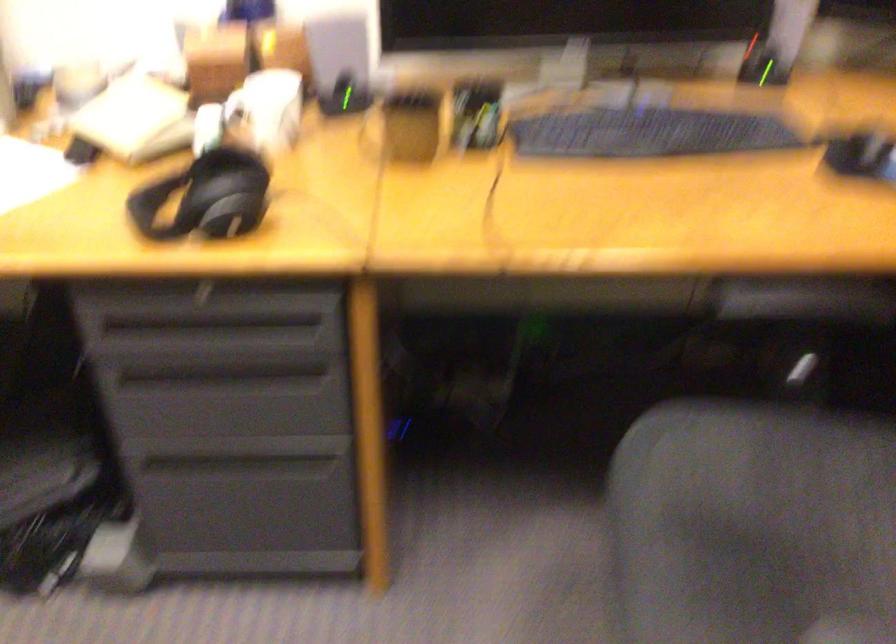
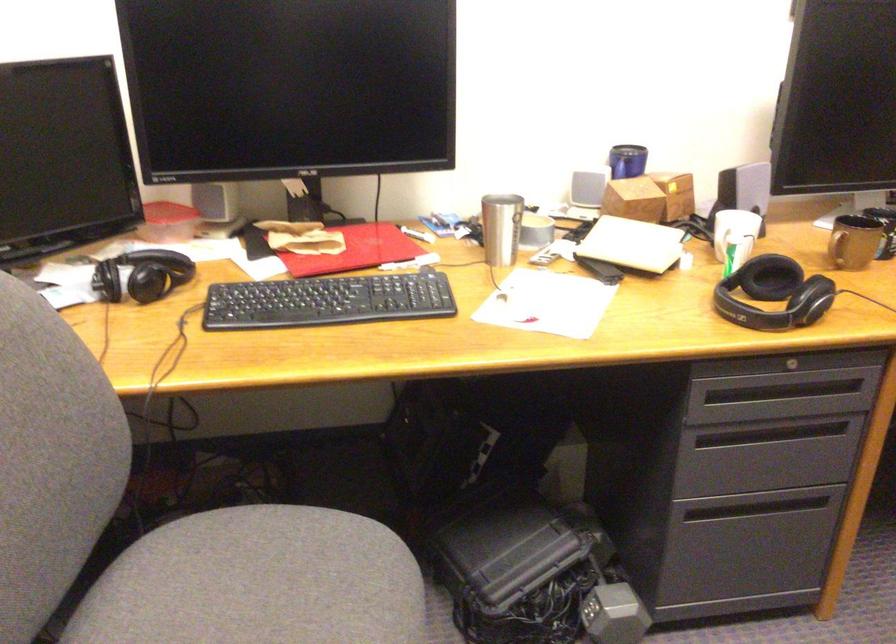
Where in the second image is the point corresponding to (392,140) from the first image?

(854, 242)